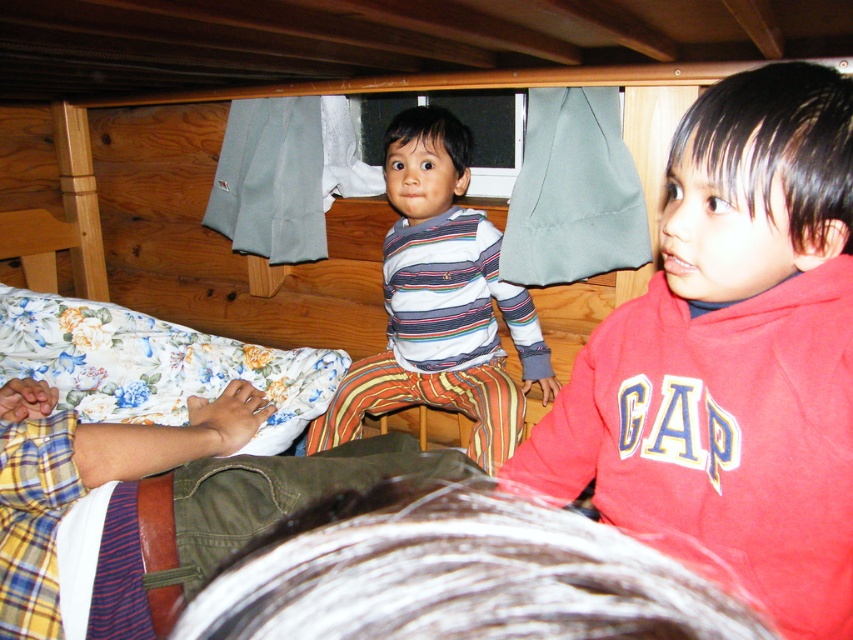
Question: Is red cotton hoodie at upper right bigger than striped cotton shirt at center?

Choices:
 (A) no
 (B) yes

Answer: (A)

Question: From the image, what is the correct spatial relationship of red cotton hoodie at upper right in relation to striped cotton shirt at center?

Choices:
 (A) below
 (B) above

Answer: (A)

Question: Among these objects, which one is farthest from the camera?

Choices:
 (A) striped cotton shirt at center
 (B) red cotton hoodie at upper right

Answer: (A)

Question: Which of the following is the closest to the observer?

Choices:
 (A) striped cotton shirt at center
 (B) red cotton hoodie at upper right

Answer: (B)

Question: From the image, what is the correct spatial relationship of red cotton hoodie at upper right in relation to striped cotton shirt at center?

Choices:
 (A) above
 (B) below

Answer: (B)